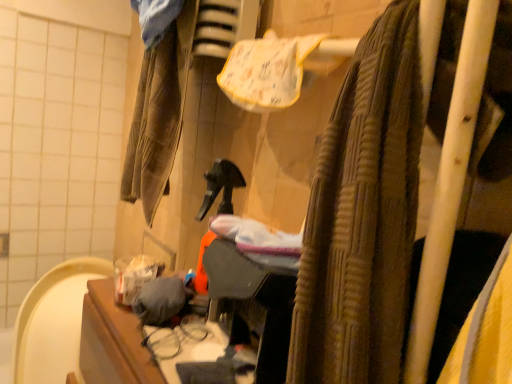
Question: Is gray fabric at center, the 2th clothing when ordered from top to bottom, situated inside brown corduroy pants at left, the first clothing positioned from the back, or outside?

Choices:
 (A) inside
 (B) outside

Answer: (B)

Question: From the image's perspective, is gray fabric at center, which is counted as the 1th clothing, starting from the front, located above or below brown corduroy pants at left, the first clothing in the top-to-bottom sequence?

Choices:
 (A) above
 (B) below

Answer: (B)

Question: Which object is the closest to the brown corduroy pants at left, the first clothing positioned from the back?

Choices:
 (A) brown textured towel at upper right
 (B) gray fabric at center, which is counted as the first clothing, starting from the bottom

Answer: (B)

Question: Estimate the real-world distances between objects in this image. Which object is farther from the brown textured towel at upper right?

Choices:
 (A) gray fabric at center, the 2th clothing when ordered from top to bottom
 (B) brown corduroy pants at left, the second clothing when ordered from bottom to top

Answer: (B)